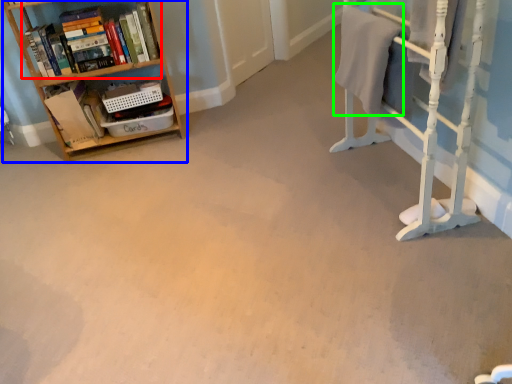
Question: Considering the real-world distances, which object is closest to book (highlighted by a red box)? shelf (highlighted by a blue box) or bath towel (highlighted by a green box).

Choices:
 (A) shelf
 (B) bath towel

Answer: (A)